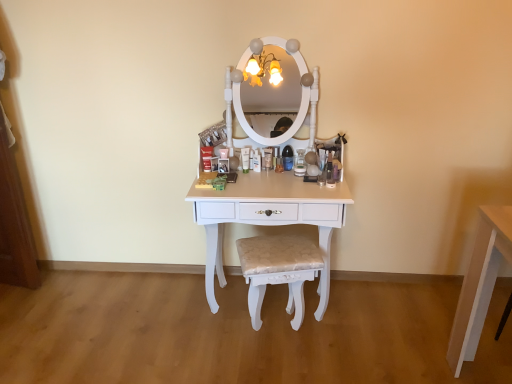
At what (x,y) coordinates should I click in order to perform the action: click on vacant area to the right of white glossy table at center. Please return your answer as a coordinate pair (x, y). Looking at the image, I should click on (389, 321).